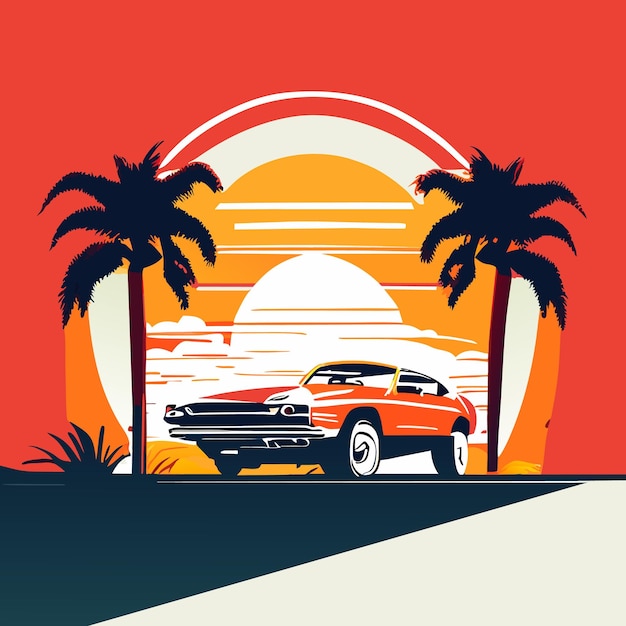
The image size is (626, 626). What are the coordinates of `plant` in the screenshot? It's located at (72, 471).